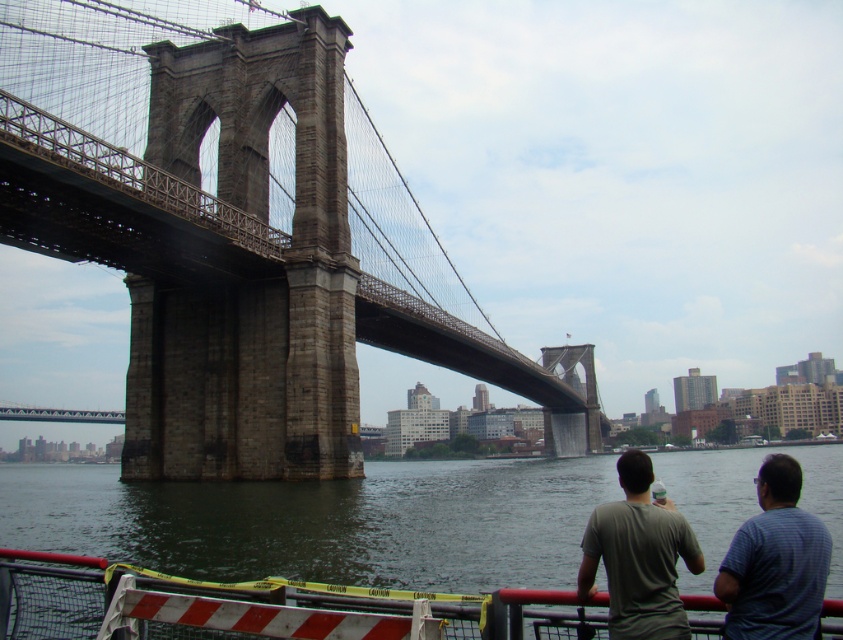
Where is the gray cotton shirt at lower right located in the image?

The gray cotton shirt at lower right is located at point (662, 544).